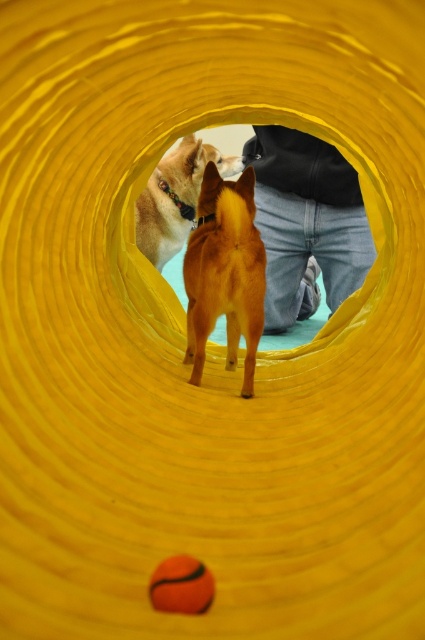
Which of these two, shiny golden fur at center or shiny brown fur at center, stands shorter?

Standing shorter between the two is shiny golden fur at center.

Which is above, shiny golden fur at center or shiny brown fur at center?

shiny brown fur at center is above.

Between point (246, 372) and point (178, 236), which one is positioned in front?

Positioned in front is point (246, 372).

The height and width of the screenshot is (640, 425). What are the coordinates of `shiny golden fur at center` in the screenshot? It's located at (224, 273).